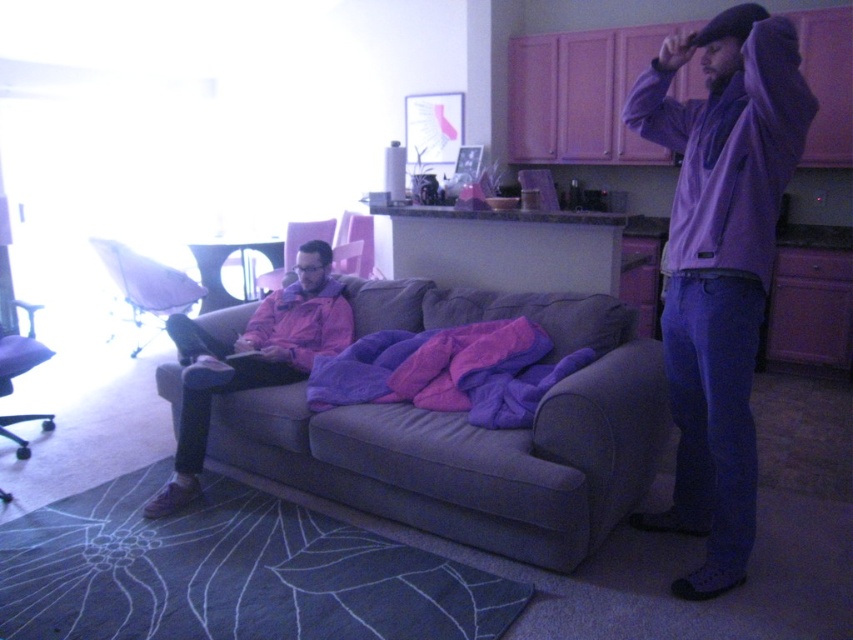
Question: Can you confirm if purple matte hoodie at right is positioned above matte pink armchair at center?

Choices:
 (A) yes
 (B) no

Answer: (B)

Question: Among these objects, which one is farthest from the camera?

Choices:
 (A) pink matte jacket at center
 (B) matte pink armchair at center
 (C) matte purple swivel chair at left

Answer: (B)

Question: Considering the real-world distances, which object is farthest from the purple matte hoodie at right?

Choices:
 (A) matte pink armchair at center
 (B) matte purple swivel chair at left
 (C) metallic silver swivel chair at left

Answer: (C)

Question: Which point appears farthest from the camera in this image?

Choices:
 (A) (207, 342)
 (B) (289, 259)

Answer: (B)

Question: Where is purple matte hoodie at right located in relation to pink fabric armchair at center in the image?

Choices:
 (A) right
 (B) left

Answer: (A)

Question: Is metallic silver swivel chair at left closer to camera compared to matte pink armchair at center?

Choices:
 (A) yes
 (B) no

Answer: (A)